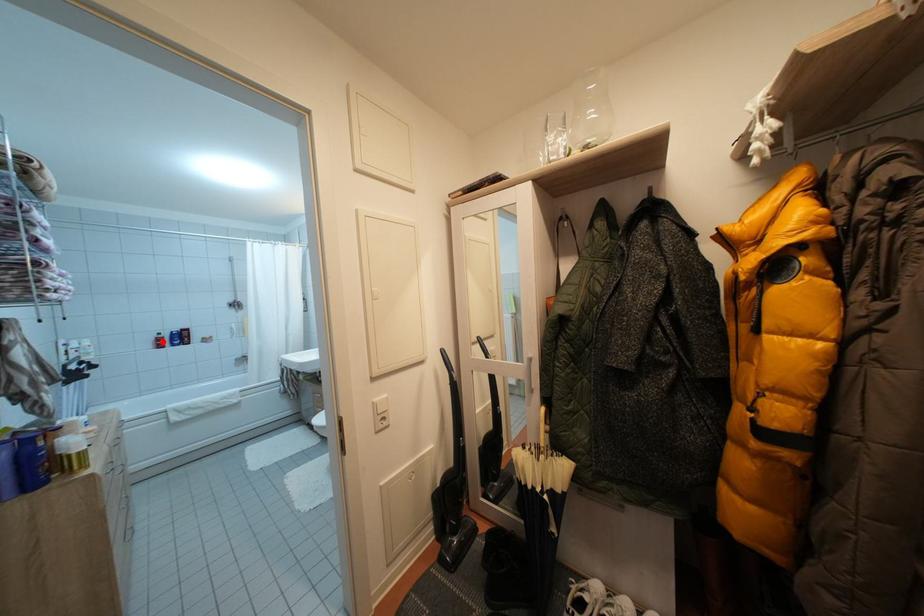
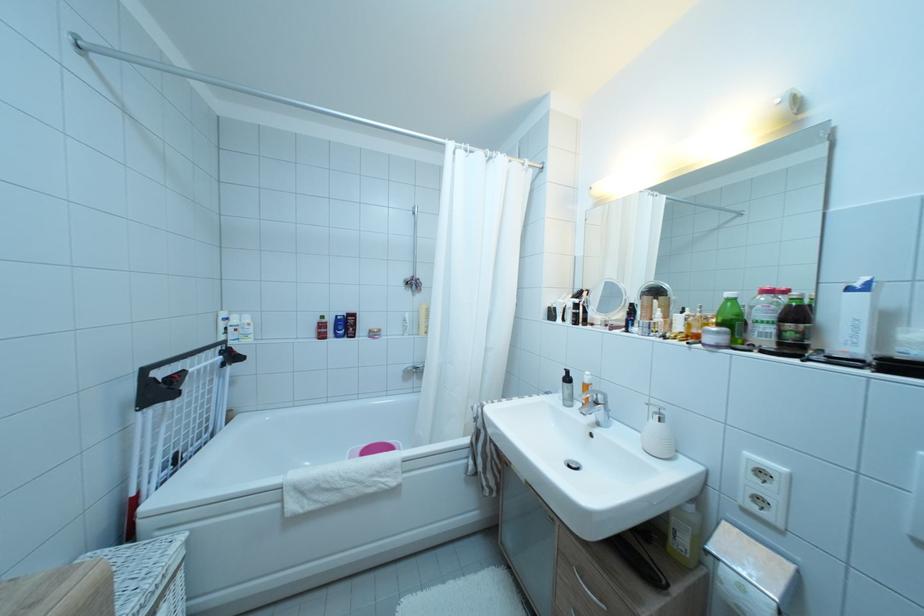
In the second image, find the point that corresponds to the highlighted location in the first image.

(324, 325)